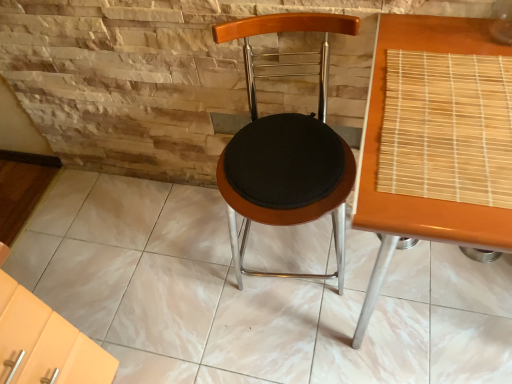
The height and width of the screenshot is (384, 512). I want to click on free spot behind bamboo mat at right, so click(435, 43).